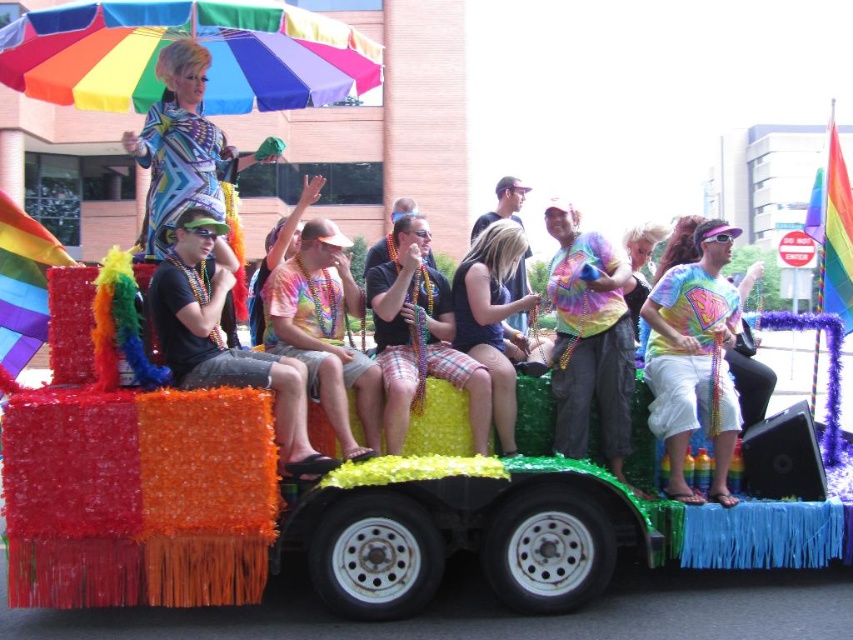
Question: Estimate the real-world distances between objects in this image. Which object is farther from the neon tie-dye shirt at center?

Choices:
 (A) black fabric tank top at center
 (B) rainbow tie-dye shirt at center
 (C) rainbow fabric umbrella at upper left

Answer: (C)

Question: Which of the following is the farthest from the observer?

Choices:
 (A) rainbow tie-dye shirt at center
 (B) plaid shorts at center
 (C) matte black shirt at center
 (D) rainbow fabric umbrella at upper left

Answer: (B)

Question: Can you confirm if neon tie-dye shirt at center is positioned to the right of plaid shorts at center?

Choices:
 (A) no
 (B) yes

Answer: (B)

Question: Can you confirm if matte black shirt at center is wider than neon yellow shorts at center?

Choices:
 (A) no
 (B) yes

Answer: (B)

Question: In this image, where is tie-dye fabric shorts at center located relative to plaid shorts at center?

Choices:
 (A) above
 (B) below

Answer: (B)

Question: Which object is closer to the camera taking this photo?

Choices:
 (A) rainbow tie-dye shirt at center
 (B) rainbow fabric umbrella at upper left
 (C) matte black shirt at center

Answer: (C)